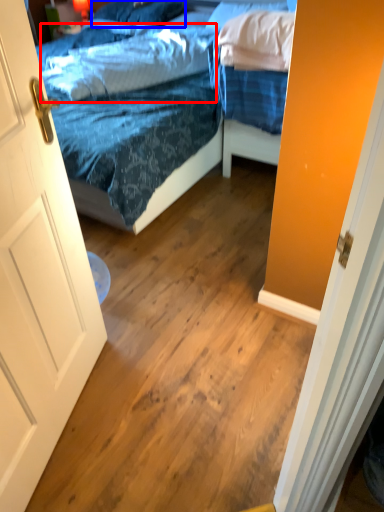
Question: Which of the following is the farthest to the observer, pillow (highlighted by a red box) or pillow (highlighted by a blue box)?

Choices:
 (A) pillow
 (B) pillow

Answer: (B)